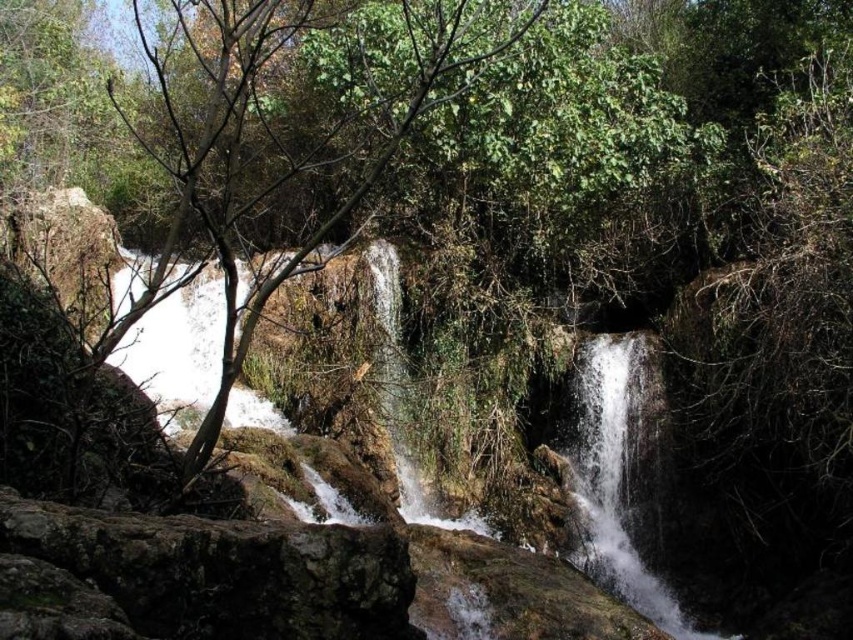
You are standing near the cascading waterfalls and want to place a small decorative rock on the rough textured rock at center. Can you see the clear water at center from where the decorative rock will be placed?

The rough textured rock at center is positioned over clear water at center, so placing the decorative rock there would mean it is above the clear water at center. Therefore, yes, you can see the clear water at center from where the decorative rock will be placed.

You are standing at the edge of the cascading waterfalls and see the rough textured rock at center and the clear water at center. Which object is located to the left of the other?

The rough textured rock at center is positioned on the left side of clear water at center.

You are a hiker standing at the edge of the cascading waterfalls. You notice a point marked at coordinates (195, 577). What type of surface is located at this point?

The point at coordinates (195, 577) marks a rough textured rock at center.